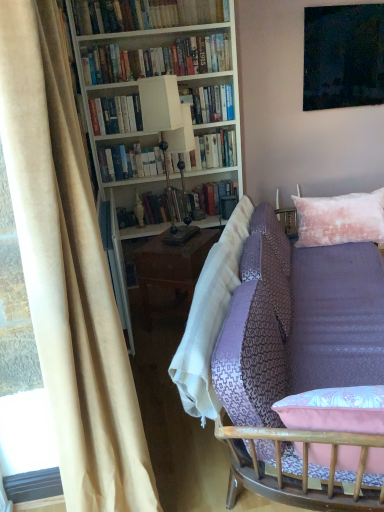
Image resolution: width=384 pixels, height=512 pixels. What do you see at coordinates (279, 353) in the screenshot?
I see `purple fabric couch at lower right` at bounding box center [279, 353].

Where is `hardcover books at center, which appears as the first book when ordered from the bottom`? This screenshot has width=384, height=512. hardcover books at center, which appears as the first book when ordered from the bottom is located at coordinates (207, 153).

This screenshot has width=384, height=512. What do you see at coordinates (210, 103) in the screenshot? I see `hardcover book at upper center, the third book from the top` at bounding box center [210, 103].

The height and width of the screenshot is (512, 384). Describe the element at coordinates (156, 104) in the screenshot. I see `white wood bookcase at upper left` at that location.

Find the location of a particular element. hardcover books at upper center, placed as the 4th book when sorted from bottom to top is located at coordinates (145, 14).

From the image's perspective, is purple fabric couch at lower right on hardcover book at upper center, placed as the second book when sorted from bottom to top?

Actually, purple fabric couch at lower right appears below hardcover book at upper center, placed as the second book when sorted from bottom to top, in the image.

Considering the relative sizes of purple fabric couch at lower right and hardcover book at upper center, the third book from the top, in the image provided, is purple fabric couch at lower right smaller than hardcover book at upper center, the third book from the top,?

No, purple fabric couch at lower right is not smaller than hardcover book at upper center, the third book from the top.

You are a GUI agent. You are given a task and a screenshot of the screen. Output one action in this format:
    pyautogui.click(x=<x>, y=<y>)
    Task: Click on the studio couch on the right of hardcover book at upper center, placed as the second book when sorted from bottom to top
    
    Given the screenshot: What is the action you would take?
    pyautogui.click(x=279, y=353)

Looking at this image, is purple fabric couch at lower right facing away from hardcover book at upper center, the third book from the top?

No.

Would you say pink textured pillow at upper right is inside or outside hardcover books at center, which appears as the first book when ordered from the bottom?

pink textured pillow at upper right is not inside hardcover books at center, which appears as the first book when ordered from the bottom, it's outside.

Is pink textured pillow at upper right taller than hardcover books at center, which is the fourth book from top to bottom?

Correct, pink textured pillow at upper right is much taller as hardcover books at center, which is the fourth book from top to bottom.

Is pink textured pillow at upper right positioned far away from hardcover books at center, which appears as the first book when ordered from the bottom?

No, pink textured pillow at upper right is not far away from hardcover books at center, which appears as the first book when ordered from the bottom.

From the image's perspective, relative to hardcover books at center, which is the fourth book from top to bottom, is pink textured pillow at upper right above or below?

Based on their image positions, pink textured pillow at upper right is located beneath hardcover books at center, which is the fourth book from top to bottom.

Considering the sizes of objects hardcover books at upper center, the 1th book in the top-to-bottom sequence, and pink textured pillow at upper right in the image provided, who is thinner, hardcover books at upper center, the 1th book in the top-to-bottom sequence, or pink textured pillow at upper right?

hardcover books at upper center, the 1th book in the top-to-bottom sequence, is thinner.

The height and width of the screenshot is (512, 384). Find the location of `the 1st book behind the pink textured pillow at upper right`. the 1st book behind the pink textured pillow at upper right is located at coordinates (145, 14).

Would you say hardcover books at upper center, placed as the 4th book when sorted from bottom to top, contains pink textured pillow at upper right?

No.

Considering the relative sizes of hardcover book at upper center, the third book from the top, and white wood bookcase at upper left in the image provided, is hardcover book at upper center, the third book from the top, thinner than white wood bookcase at upper left?

Indeed, hardcover book at upper center, the third book from the top, has a lesser width compared to white wood bookcase at upper left.

Is point (229, 110) positioned before point (102, 127)?

No.

Is hardcover book at upper center, the third book from the top, outside of white wood bookcase at upper left?

That's incorrect, hardcover book at upper center, the third book from the top, is not completely outside white wood bookcase at upper left.

Considering the sizes of hardcover book at upper center, placed as the second book when sorted from bottom to top, and white wood bookcase at upper left in the image, is hardcover book at upper center, placed as the second book when sorted from bottom to top, taller or shorter than white wood bookcase at upper left?

hardcover book at upper center, placed as the second book when sorted from bottom to top, is shorter than white wood bookcase at upper left.

Measure the distance from hardcover books at upper center, arranged as the third book when ordered from the bottom, to hardcover book at upper center, placed as the second book when sorted from bottom to top.

They are 29.06 centimeters apart.

From a real-world perspective, is hardcover books at upper center, which is the 2th book from top to bottom, positioned over hardcover book at upper center, the third book from the top, based on gravity?

Correct, in the physical world, hardcover books at upper center, which is the 2th book from top to bottom, is higher than hardcover book at upper center, the third book from the top.

Which of these two, hardcover books at upper center, arranged as the third book when ordered from the bottom, or hardcover book at upper center, the third book from the top, is smaller?

hardcover book at upper center, the third book from the top.

Which object is wider, hardcover books at upper center, which is the 2th book from top to bottom, or hardcover book at upper center, placed as the second book when sorted from bottom to top?

hardcover book at upper center, placed as the second book when sorted from bottom to top, is wider.

Considering the sizes of objects white wood bookcase at upper left and hardcover books at upper center, which is the 2th book from top to bottom, in the image provided, who is thinner, white wood bookcase at upper left or hardcover books at upper center, which is the 2th book from top to bottom,?

Thinner between the two is hardcover books at upper center, which is the 2th book from top to bottom.

Is white wood bookcase at upper left touching hardcover books at upper center, which is the 2th book from top to bottom?

No, white wood bookcase at upper left is not next to hardcover books at upper center, which is the 2th book from top to bottom.

Is white wood bookcase at upper left surrounding hardcover books at upper center, arranged as the third book when ordered from the bottom?

Yes, hardcover books at upper center, arranged as the third book when ordered from the bottom, is inside white wood bookcase at upper left.

From a real-world perspective, who is located lower, white wood bookcase at upper left or hardcover books at upper center, which is the 2th book from top to bottom?

white wood bookcase at upper left is physically lower.

Could you tell me if hardcover books at center, which is the fourth book from top to bottom, is turned towards hardcover books at upper center, which is the 2th book from top to bottom?

No, hardcover books at center, which is the fourth book from top to bottom, is not turned towards hardcover books at upper center, which is the 2th book from top to bottom.

From the image's perspective, would you say hardcover books at center, which appears as the first book when ordered from the bottom, is positioned over hardcover books at upper center, which is the 2th book from top to bottom?

No, from the image's perspective, hardcover books at center, which appears as the first book when ordered from the bottom, is not over hardcover books at upper center, which is the 2th book from top to bottom.

Between point (134, 163) and point (192, 39), which one is positioned behind?

The point (134, 163) is farther from the camera.

How different are the orientations of hardcover books at center, which is the fourth book from top to bottom, and hardcover books at upper center, arranged as the third book when ordered from the bottom, in degrees?

The angular difference between hardcover books at center, which is the fourth book from top to bottom, and hardcover books at upper center, arranged as the third book when ordered from the bottom, is 0.251 degrees.

What are the coordinates of `studio couch in front of the hardcover book at upper center, the third book from the top` in the screenshot? It's located at (279, 353).

Where is `the 4th book behind when counting from the pink textured pillow at upper right`? The image size is (384, 512). the 4th book behind when counting from the pink textured pillow at upper right is located at coordinates (207, 153).

From the image, which object appears to be farther from white wood bookcase at upper left, hardcover books at upper center, placed as the 4th book when sorted from bottom to top, or pink textured pillow at upper right?

pink textured pillow at upper right.

From the image, which object appears to be nearer to hardcover book at upper center, the third book from the top, purple fabric couch at lower right or white matte lamp at center?

white matte lamp at center is positioned closer to the anchor hardcover book at upper center, the third book from the top.

From the image, which object appears to be farther from hardcover books at upper center, which is the 2th book from top to bottom, white matte lamp at center or hardcover book at upper center, placed as the second book when sorted from bottom to top?

The object further to hardcover books at upper center, which is the 2th book from top to bottom, is white matte lamp at center.

Based on their spatial positions, is pink textured pillow at upper right or hardcover books at upper center, the 1th book in the top-to-bottom sequence, closer to purple fabric couch at lower right?

pink textured pillow at upper right is positioned closer to the anchor purple fabric couch at lower right.

Looking at the image, which one is located closer to white matte lamp at center, hardcover books at upper center, arranged as the third book when ordered from the bottom, or white wood bookcase at upper left?

white wood bookcase at upper left lies closer to white matte lamp at center than the other object.

Considering their positions, is white matte lamp at center positioned closer to purple fabric couch at lower right than pink textured pillow at upper right?

The object closer to purple fabric couch at lower right is pink textured pillow at upper right.

Based on their spatial positions, is beige velvet curtain at left or white matte lamp at center further from hardcover book at upper center, placed as the second book when sorted from bottom to top?

The object further to hardcover book at upper center, placed as the second book when sorted from bottom to top, is beige velvet curtain at left.

From the image, which object appears to be farther from purple fabric couch at lower right, hardcover books at upper center, arranged as the third book when ordered from the bottom, or hardcover books at upper center, placed as the 4th book when sorted from bottom to top?

Among the two, hardcover books at upper center, placed as the 4th book when sorted from bottom to top, is located further to purple fabric couch at lower right.

This screenshot has height=512, width=384. I want to click on lamp between hardcover books at upper center, the 1th book in the top-to-bottom sequence, and purple fabric couch at lower right, in the vertical direction, so click(168, 134).

I want to click on bookcase between hardcover books at upper center, the 1th book in the top-to-bottom sequence, and pink textured pillow at upper right in the up-down direction, so click(x=156, y=104).

Where is `lamp between purple fabric couch at lower right and hardcover books at center, which is the fourth book from top to bottom, in the front-back direction`? Image resolution: width=384 pixels, height=512 pixels. lamp between purple fabric couch at lower right and hardcover books at center, which is the fourth book from top to bottom, in the front-back direction is located at coordinates (168, 134).

This screenshot has height=512, width=384. In order to click on lamp between purple fabric couch at lower right and white wood bookcase at upper left from front to back in this screenshot , I will do `click(168, 134)`.